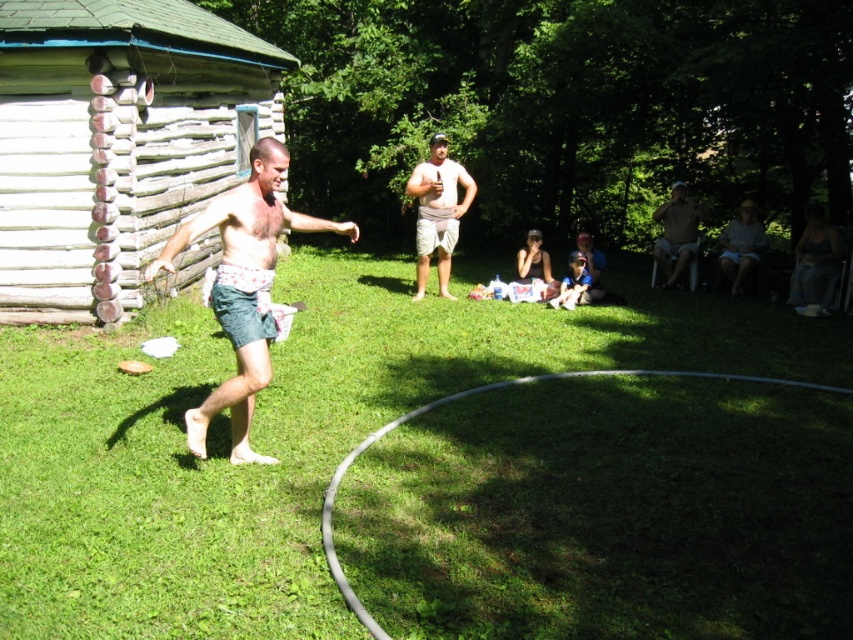
Between camouflage shorts at center and matte brown shirt at right, which one has more height?

Standing taller between the two is camouflage shorts at center.

Which is above, camouflage shorts at center or matte brown shirt at right?

Positioned higher is matte brown shirt at right.

Find the location of a particular element. This screenshot has height=640, width=853. camouflage shorts at center is located at coordinates (437, 211).

This screenshot has height=640, width=853. Find the location of `camouflage shorts at center`. camouflage shorts at center is located at coordinates [437, 211].

Which of these two, green grass at center or weathered wood log cabin at left, stands shorter?

With less height is green grass at center.

I want to click on green grass at center, so click(x=285, y=436).

Who is positioned more to the right, denim shorts at center or camouflage shorts at center?

Positioned to the right is camouflage shorts at center.

Can you confirm if denim shorts at center is taller than camouflage shorts at center?

Indeed, denim shorts at center has a greater height compared to camouflage shorts at center.

You are a GUI agent. You are given a task and a screenshot of the screen. Output one action in this format:
    pyautogui.click(x=<x>, y=<y>)
    Task: Click on the denim shorts at center
    The height and width of the screenshot is (640, 853).
    Given the screenshot: What is the action you would take?
    pyautogui.click(x=242, y=288)